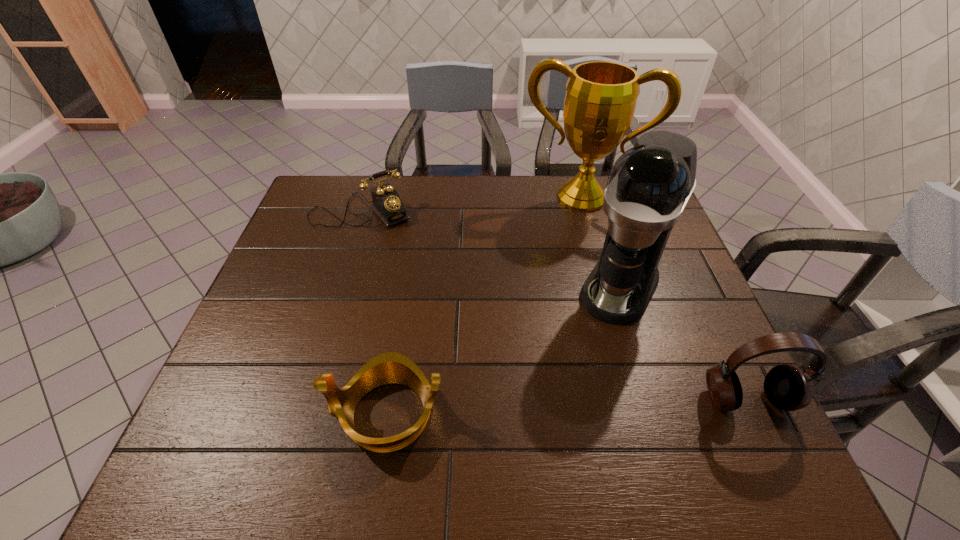
Identify the location of vacant region at the left edge of the desktop. (331, 233).

The image size is (960, 540). In order to click on vacant space at the right edge of the desktop in this screenshot , I will do `click(702, 348)`.

This screenshot has width=960, height=540. I want to click on vacant area at the far left corner of the desktop, so click(x=330, y=191).

In the image, there is a desktop. Where is `vacant region at the near right corner`? vacant region at the near right corner is located at coordinates (693, 421).

At what (x,y) coordinates should I click in order to perform the action: click on free space that is in between the award and the tiara. Please return your answer as a coordinate pair (x, y). Image resolution: width=960 pixels, height=540 pixels. Looking at the image, I should click on (484, 306).

The height and width of the screenshot is (540, 960). I want to click on free area in between the headset and the award, so click(x=664, y=298).

Locate an element on the screen. empty location between the headset and the tiara is located at coordinates (566, 406).

Find the location of a particular element. free space between the telephone and the tiara is located at coordinates (x=373, y=312).

The height and width of the screenshot is (540, 960). I want to click on vacant area that lies between the third farthest object and the telephone, so click(x=491, y=249).

This screenshot has height=540, width=960. In order to click on free space between the third tallest object and the third nearest object in this screenshot , I will do `click(684, 343)`.